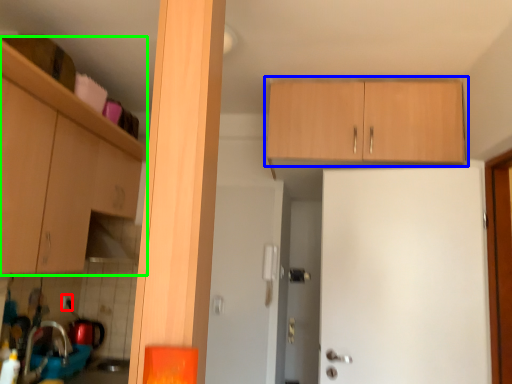
Question: Which object is the closest to the electric outlet (highlighted by a red box)? Choose among these: cabinetry (highlighted by a blue box) or cabinetry (highlighted by a green box).

Choices:
 (A) cabinetry
 (B) cabinetry

Answer: (B)